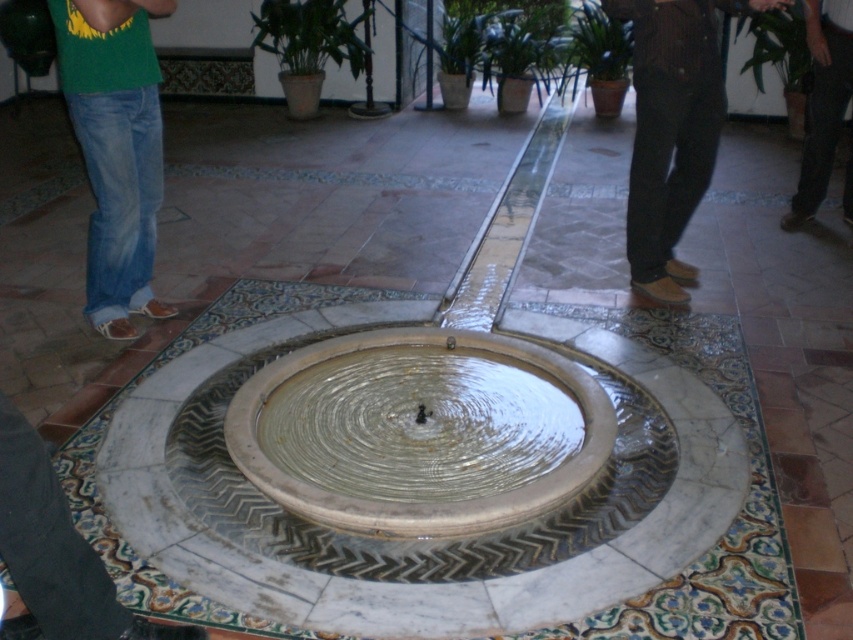
You are standing on the tiled floor and see the clear glass water at center and the dark brown leather shoes at lower right. Which object is shorter in height?

The clear glass water at center has a lesser height compared to the dark brown leather shoes at lower right, so the clear glass water at center is shorter in height.

You are standing at the edge of the clear glass water at center and want to place your dark brown leather shoes at lower right near the water. Based on the scene description, can you determine if the water is wide enough to accommodate your shoes without them getting wet?

The clear glass water at center might be wider than dark brown leather shoes at lower right, so there is a possibility that the water is wide enough to place the shoes nearby without them getting wet, but there is uncertainty due to the comparative description.